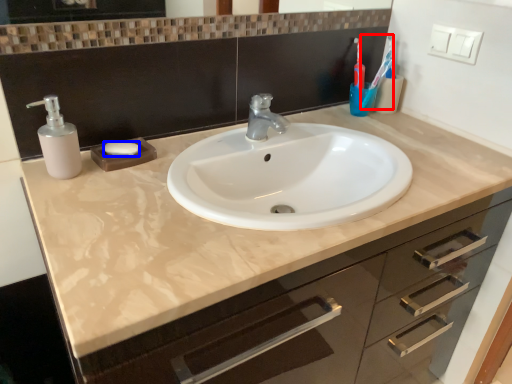
Question: Which object is further to the camera taking this photo, toothbrush (highlighted by a red box) or soap (highlighted by a blue box)?

Choices:
 (A) toothbrush
 (B) soap

Answer: (A)